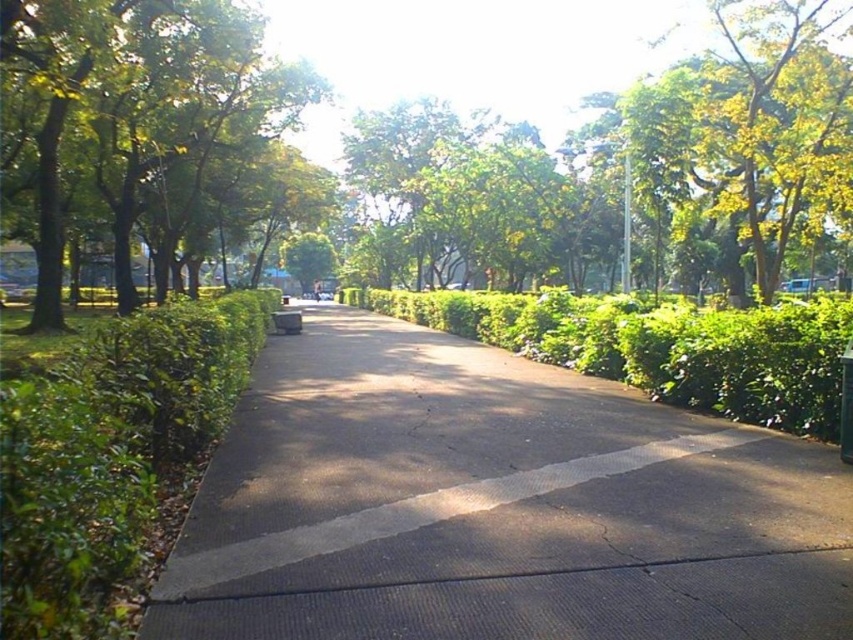
You are standing in the park and want to reach the point at coordinates (228, 140). If your walking speed is 1.5 meters per second, how many seconds will it take you to reach that point?

The distance between you and the point at coordinates (228, 140) is 24.69 meters. At a walking speed of 1.5 meters per second, it will take approximately 16.46 seconds to reach the point.

You are standing at the starting point of the park pathway and see two points marked on the path. The first point is at coordinates point [119,275] and the second is at point [173,490]. Which point is farther away from you along the path?

Point [119,275] is behind point [173,490], so it is farther away from you along the path.

You are standing at the park entrance and see the point marked at coordinates (495, 506). What is located at that point?

The point at coordinates (495, 506) corresponds to dark gray asphalt at center.